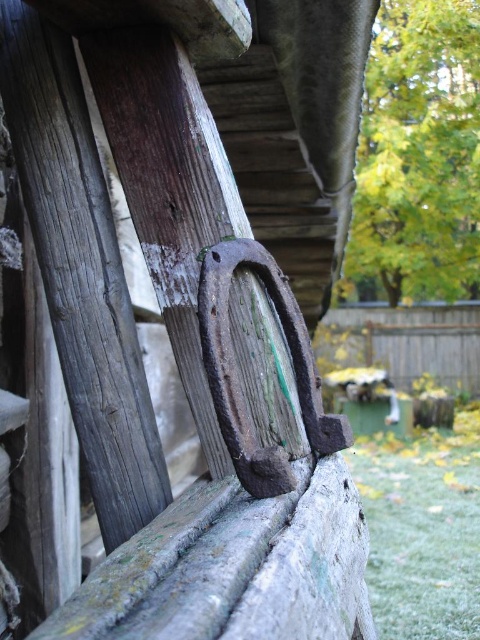
Question: Is green leafy tree at upper right closer to the viewer compared to green grass at lower right?

Choices:
 (A) yes
 (B) no

Answer: (B)

Question: Can you confirm if green leafy tree at upper right is bigger than green grass at lower right?

Choices:
 (A) no
 (B) yes

Answer: (B)

Question: Which point is farther to the camera?

Choices:
 (A) (x=382, y=528)
 (B) (x=399, y=96)

Answer: (B)

Question: Which point appears closest to the camera in this image?

Choices:
 (A) (405, 132)
 (B) (398, 604)

Answer: (B)

Question: Is green leafy tree at upper right positioned before green grass at lower right?

Choices:
 (A) no
 (B) yes

Answer: (A)